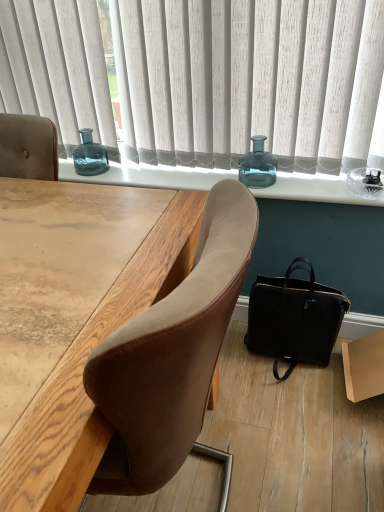
Question: From a real-world perspective, is teal glass vase at center above or below brown cardboard box at lower right?

Choices:
 (A) above
 (B) below

Answer: (A)

Question: Is teal glass vase at center to the left or to the right of brown cardboard box at lower right in the image?

Choices:
 (A) right
 (B) left

Answer: (B)

Question: Which is farther from the wooden desk at center?

Choices:
 (A) transparent glass vase at upper center, which is counted as the 1th bottle, starting from the right
 (B) teal glass vase at center
 (C) white fabric curtain at upper center
 (D) teal glass bottle at upper center, which is counted as the first bottle, starting from the back
 (E) black leather handbag at lower right

Answer: (D)

Question: Which is farther from the transparent glass vase at upper center, the 2th bottle from the back?

Choices:
 (A) white fabric curtain at upper center
 (B) wooden desk at center
 (C) black leather handbag at lower right
 (D) teal glass vase at center
 (E) teal glass bottle at upper center, the 2th bottle viewed from the right

Answer: (B)